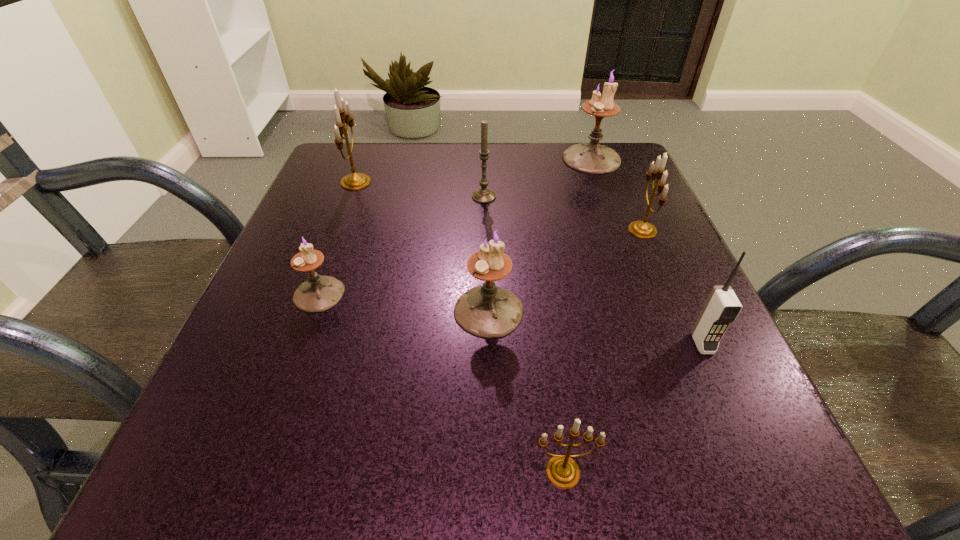
Image resolution: width=960 pixels, height=540 pixels. I want to click on the rightmost purple candle holder, so click(x=591, y=157).

Find the location of `the farthest purple candle holder`. the farthest purple candle holder is located at coordinates (591, 157).

At what (x,y) coordinates should I click in order to perform the action: click on the biggest gold candelabrum. Please return your answer as a coordinate pair (x, y). Looking at the image, I should click on (355, 181).

At what (x,y) coordinates should I click in order to perform the action: click on the farthest gold candelabrum. Please return your answer as a coordinate pair (x, y). Looking at the image, I should click on (355, 181).

You are a GUI agent. You are given a task and a screenshot of the screen. Output one action in this format:
    pyautogui.click(x=<x>, y=<y>)
    Task: Click on the candle
    This screenshot has width=960, height=540.
    Given the screenshot: What is the action you would take?
    pyautogui.click(x=483, y=195)

The image size is (960, 540). I want to click on cellular telephone, so click(x=722, y=307).

The image size is (960, 540). I want to click on the second purple candle holder from left to right, so click(x=488, y=311).

Locate an element on the screen. the second nearest gold candelabrum is located at coordinates (642, 229).

Locate an element on the screen. the second biggest gold candelabrum is located at coordinates coord(642,229).

This screenshot has width=960, height=540. I want to click on the smallest purple candle holder, so click(319, 293).